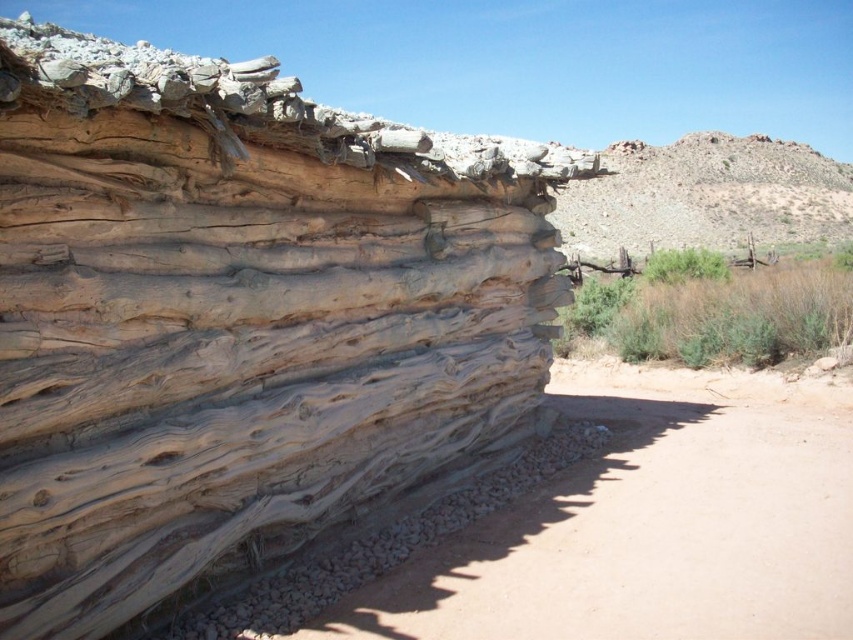
You are a hiker trying to reach the smooth beige rock at center from the brown dirt track at lower left. Can you walk directly to the rock along the track?

The smooth beige rock at center is positioned over the brown dirt track at lower left, so the track is blocked by the rock. You cannot walk directly to the rock along the track.

You are standing at the base of the large eroded rock formation and want to walk to the brown dirt track at lower left. Which direction should you move relative to the smooth beige rock at center?

You should move towards the direction away from the smooth beige rock at center because the brown dirt track at lower left is behind it according to the spatial relationship described.